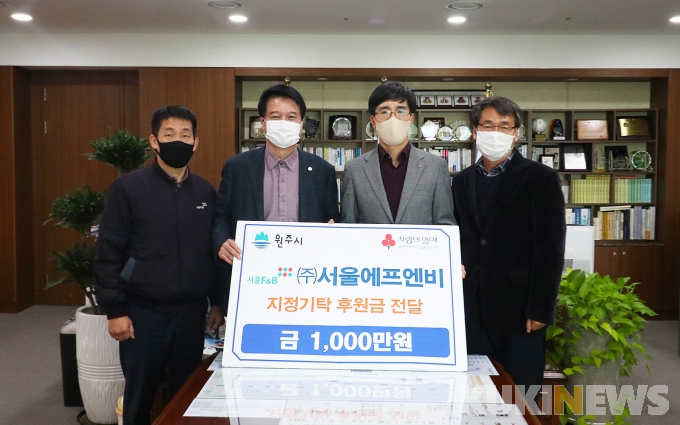
The width and height of the screenshot is (680, 425). Find the location of `certificate`. certificate is located at coordinates click(596, 136).